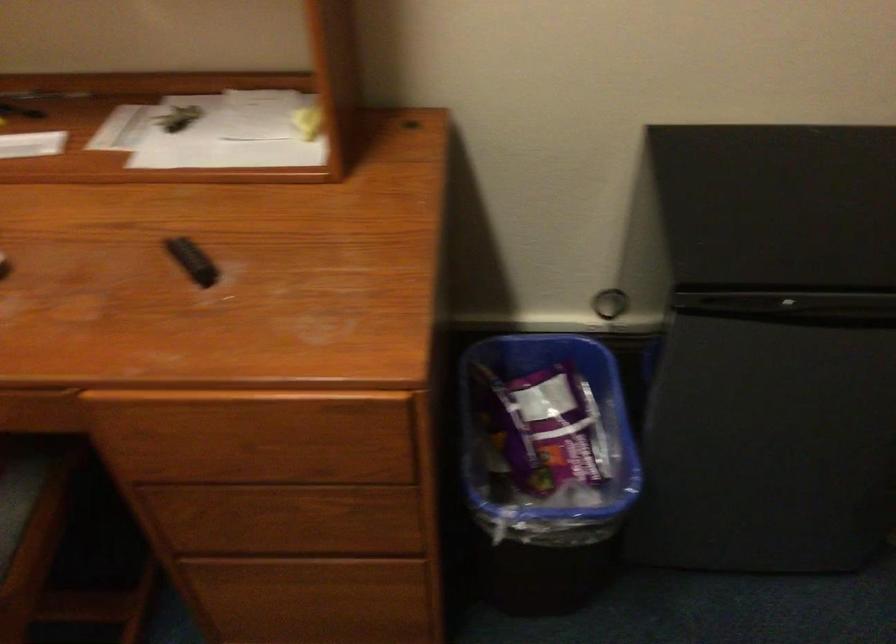
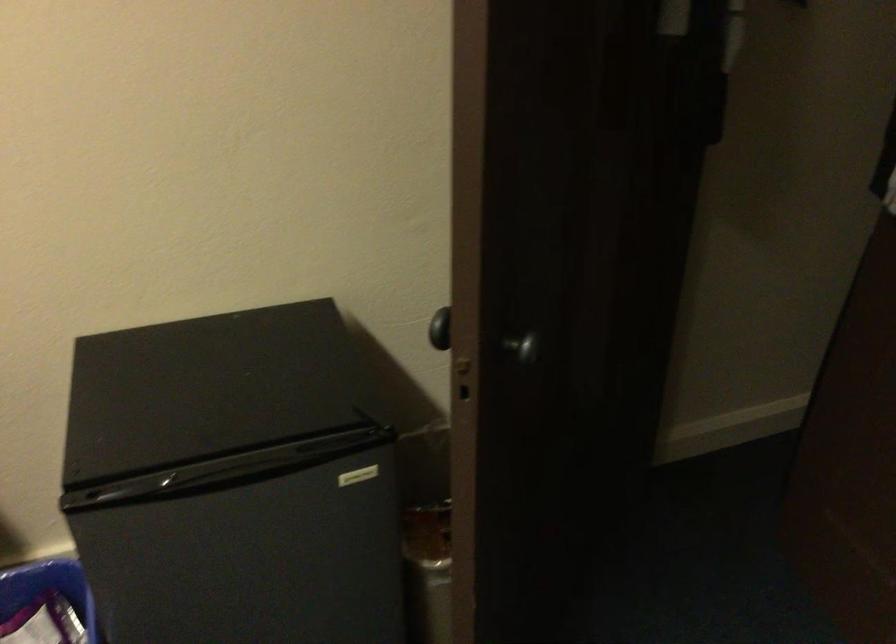
Question: The camera is either moving clockwise (left) or counter-clockwise (right) around the object. The first image is from the beginning of the video and the second image is from the end. Is the camera moving left or right when shooting the video?

Choices:
 (A) Left
 (B) Right

Answer: (A)